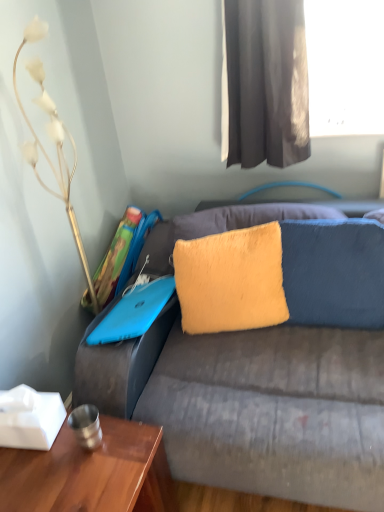
Question: Is dark gray fabric curtain at upper center located outside yellow fuzzy pillow at center, placed as the 2th pillow when sorted from left to right?

Choices:
 (A) no
 (B) yes

Answer: (B)

Question: From the image's perspective, is dark gray fabric curtain at upper center over yellow fuzzy pillow at center, marked as the first pillow in a right-to-left arrangement?

Choices:
 (A) no
 (B) yes

Answer: (B)

Question: Considering the relative sizes of dark gray fabric curtain at upper center and yellow fuzzy pillow at center, marked as the first pillow in a right-to-left arrangement, in the image provided, is dark gray fabric curtain at upper center bigger than yellow fuzzy pillow at center, marked as the first pillow in a right-to-left arrangement,?

Choices:
 (A) no
 (B) yes

Answer: (B)

Question: Is dark gray fabric curtain at upper center thinner than yellow fuzzy pillow at center, placed as the 2th pillow when sorted from left to right?

Choices:
 (A) no
 (B) yes

Answer: (A)

Question: From a real-world perspective, is dark gray fabric curtain at upper center under yellow fuzzy pillow at center, placed as the 2th pillow when sorted from left to right?

Choices:
 (A) no
 (B) yes

Answer: (A)

Question: In terms of width, does yellow furry pillow at center, which ranks as the first pillow in left-to-right order, look wider or thinner when compared to dark gray fabric curtain at upper center?

Choices:
 (A) thin
 (B) wide

Answer: (A)

Question: Is point tap(266, 317) closer or farther from the camera than point tap(261, 48)?

Choices:
 (A) closer
 (B) farther

Answer: (A)

Question: Based on their sizes in the image, would you say yellow furry pillow at center, which ranks as the 2th pillow in right-to-left order, is bigger or smaller than dark gray fabric curtain at upper center?

Choices:
 (A) big
 (B) small

Answer: (B)

Question: From a real-world perspective, is yellow furry pillow at center, which ranks as the 2th pillow in right-to-left order, positioned above or below dark gray fabric curtain at upper center?

Choices:
 (A) below
 (B) above

Answer: (A)

Question: In terms of size, does blue matte laptop at upper left appear bigger or smaller than metallic gold decorative at left?

Choices:
 (A) small
 (B) big

Answer: (A)

Question: Is point (147, 323) closer or farther from the camera than point (36, 138)?

Choices:
 (A) farther
 (B) closer

Answer: (B)

Question: From the image's perspective, is blue matte laptop at upper left above or below metallic gold decorative at left?

Choices:
 (A) above
 (B) below

Answer: (B)

Question: From a real-world perspective, is blue matte laptop at upper left above or below metallic gold decorative at left?

Choices:
 (A) above
 (B) below

Answer: (B)

Question: From a real-world perspective, is metallic gold decorative at left physically located above or below yellow fuzzy pillow at center, placed as the 2th pillow when sorted from left to right?

Choices:
 (A) above
 (B) below

Answer: (A)

Question: Based on their sizes in the image, would you say metallic gold decorative at left is bigger or smaller than yellow fuzzy pillow at center, marked as the first pillow in a right-to-left arrangement?

Choices:
 (A) small
 (B) big

Answer: (B)